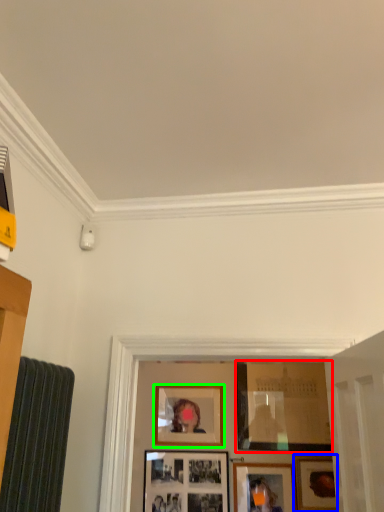
Question: Estimate the real-world distances between objects in this image. Which object is closer to picture frame (highlighted by a red box), picture frame (highlighted by a blue box) or picture frame (highlighted by a green box)?

Choices:
 (A) picture frame
 (B) picture frame

Answer: (A)